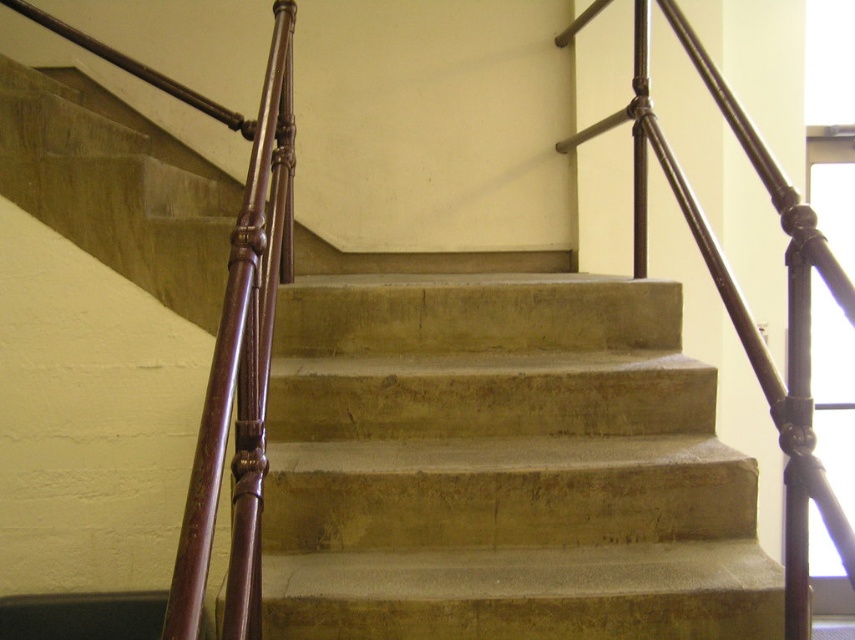
You are moving a large wooden box that is 2 meters wide. You need to carry it down the staircase while holding onto the handrails. Can the box fit through the space between the polished dark brown metal railing at upper right and the concrete stairs at center?

The concrete stairs at center are wider than the polished dark brown metal railing at upper right. Since the box is 2 meters wide, it should fit between them as long as the total available space is at least 2 meters. However, the exact fit depends on the specific dimensions of both objects, which aren

You are a painter who needs to paint both the concrete stairs at center and the polished dark brown metal railing at upper right. You have a 24 inch wide paint roller. Can you paint both objects without moving the roller? Explain why or why not.

The concrete stairs at center and the polished dark brown metal railing at upper right are 24.86 inches apart. Since the distance between them is slightly more than the 24 inch width of the roller, the painter cannot paint both objects without moving the roller.

You are standing at the bottom of the staircase and want to reach the railing. Which object should you move towards, the concrete stairs at center or the polished dark brown metal railing at upper right?

You should move towards the polished dark brown metal railing at upper right because it is positioned above the concrete stairs at center, meaning it is higher up the staircase.